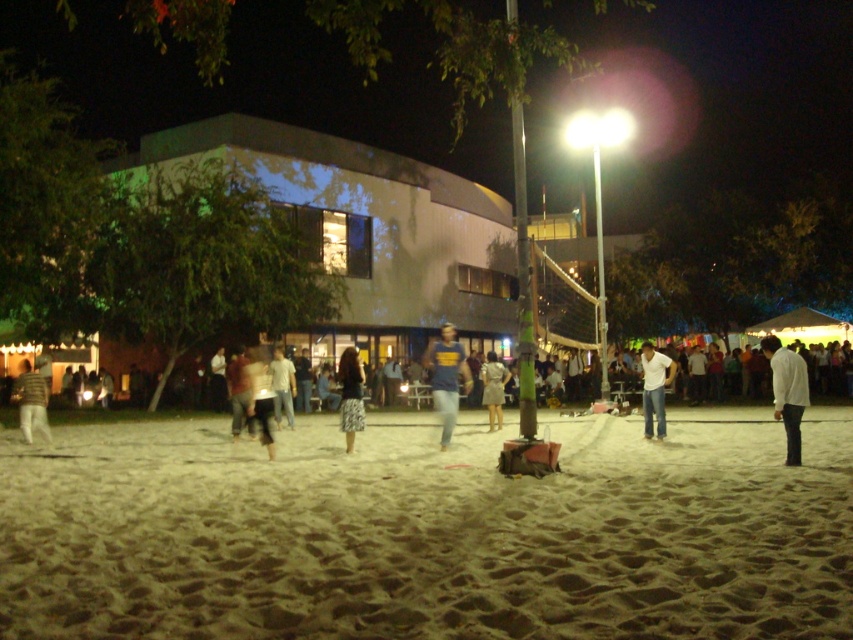
Is white matte shirt at lower right to the right of light gray dress at center from the viewer's perspective?

Correct, you'll find white matte shirt at lower right to the right of light gray dress at center.

Is white matte shirt at lower right wider than light gray dress at center?

Yes.

Is point (791, 417) closer to viewer compared to point (498, 365)?

Yes, point (791, 417) is closer to viewer.

Where is `white matte shirt at lower right`? The height and width of the screenshot is (640, 853). white matte shirt at lower right is located at coordinates (787, 392).

Is white matte shirt at lower right positioned before blue jersey at center?

Yes, white matte shirt at lower right is in front of blue jersey at center.

The height and width of the screenshot is (640, 853). I want to click on white matte shirt at lower right, so click(787, 392).

Identify the location of white matte shirt at lower right. The image size is (853, 640). click(787, 392).

Based on the photo, who is more forward, (x=20, y=428) or (x=285, y=410)?

Positioned in front is point (x=20, y=428).

Between striped sweater at left and light blue jeans at center, which one is positioned lower?

Positioned lower is light blue jeans at center.

The height and width of the screenshot is (640, 853). What do you see at coordinates (32, 403) in the screenshot?
I see `striped sweater at left` at bounding box center [32, 403].

At what (x,y) coordinates should I click in order to perform the action: click on striped sweater at left. Please return your answer as a coordinate pair (x, y). This screenshot has width=853, height=640. Looking at the image, I should click on (32, 403).